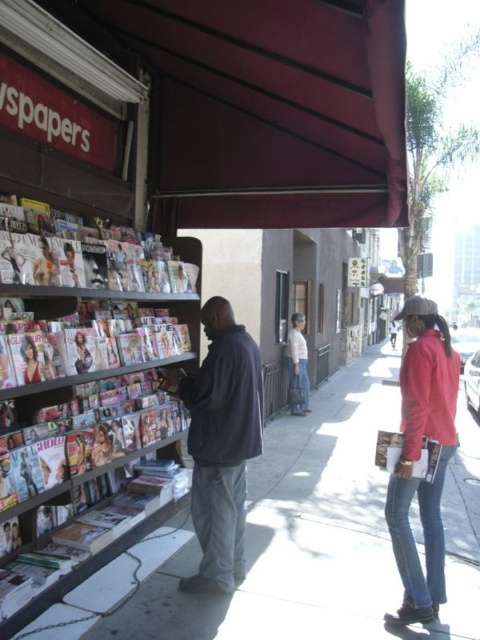
You are a delivery person who needs to place a large package between the dark gray jacket at center and the red leather jacket at right. The package is 3 feet wide. Can you fit it between them without moving either jacket?

The dark gray jacket at center is 3.39 feet away from the red leather jacket at right. Since the package is 3 feet wide, it can fit between them as the distance between the jackets is greater than the package width.

You are a delivery person standing at point (x=296, y=371) and need to deliver a package to point (x=250, y=440). Is the destination point in front of or behind your current position?

The destination point (x=250, y=440) is in front of your current position at point (x=296, y=371).